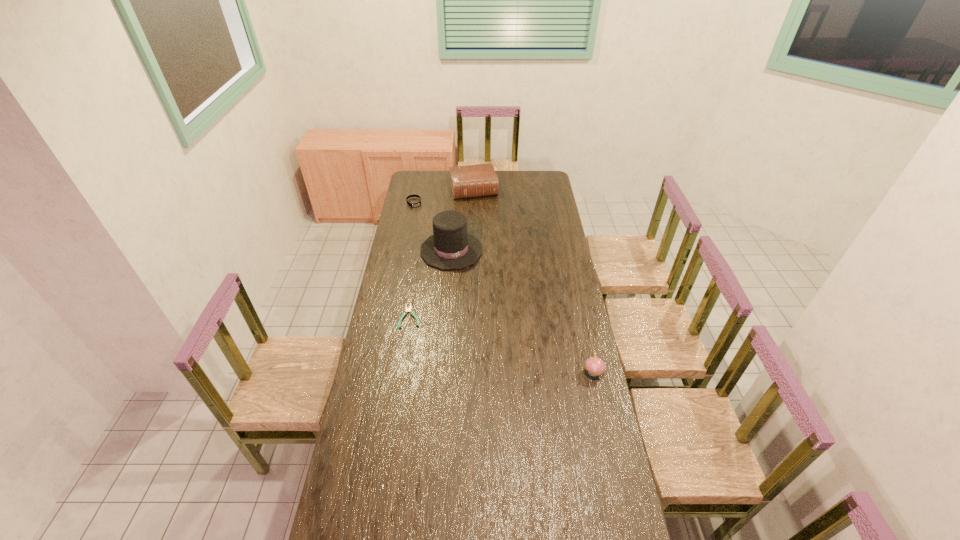
Where is `pliers that is at the left edge`? The width and height of the screenshot is (960, 540). pliers that is at the left edge is located at coordinates (407, 309).

The image size is (960, 540). I want to click on dress hat that is at the left edge, so click(450, 247).

Image resolution: width=960 pixels, height=540 pixels. I want to click on wristband situated at the left edge, so click(x=419, y=203).

Locate an element on the screen. The width and height of the screenshot is (960, 540). object that is at the right edge is located at coordinates (595, 366).

This screenshot has width=960, height=540. Identify the location of free space at the near edge of the desktop. (443, 510).

This screenshot has width=960, height=540. What are the coordinates of `vacant space at the left edge` in the screenshot? It's located at (355, 417).

Identify the location of vacant space at the right edge of the desktop. Image resolution: width=960 pixels, height=540 pixels. (547, 220).

This screenshot has width=960, height=540. Find the location of `free space between the shortest object and the tallest object`. free space between the shortest object and the tallest object is located at coordinates (431, 284).

The image size is (960, 540). Identify the location of unoccupied position between the third farthest object and the fourth tallest object. (433, 226).

Identify the location of empty space that is in between the wristband and the tallest object. The width and height of the screenshot is (960, 540). (433, 226).